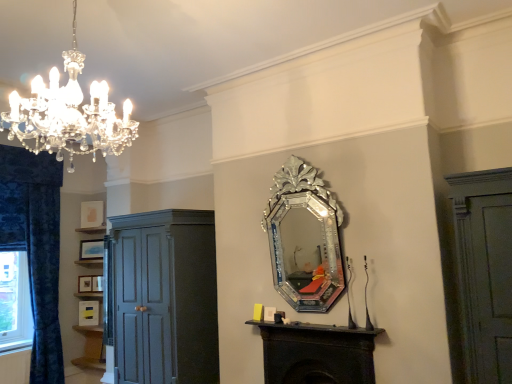
Question: In the image, is blue velvet curtain at left positioned in front of or behind silver/glass mirror at center?

Choices:
 (A) behind
 (B) front

Answer: (A)

Question: Is blue velvet curtain at left situated inside silver/glass mirror at center or outside?

Choices:
 (A) inside
 (B) outside

Answer: (B)

Question: Which object is the closest to the matte gold picture frame at left, marked as the 2th picture frame in a bottom-to-top arrangement?

Choices:
 (A) silver/glass mirror at center
 (B) blue velvet curtain at left
 (C) wooden picture frame at left, acting as the second picture frame starting from the top
 (D) matte yellow picture frame at lower left, the 1th picture frame positioned from the bottom
 (E) matte gold picture frame at upper left, the first picture frame viewed from the top

Answer: (D)

Question: Based on their relative distances, which object is nearer to the matte yellow picture frame at lower left, the 1th picture frame positioned from the bottom?

Choices:
 (A) wooden picture frame at left, acting as the second picture frame starting from the top
 (B) blue velvet curtain at left
 (C) matte gold picture frame at upper left, which ranks as the fifth picture frame in bottom-to-top order
 (D) matte dark gray cupboard at left
 (E) matte white picture frame at center, the 3th picture frame viewed from the top

Answer: (E)